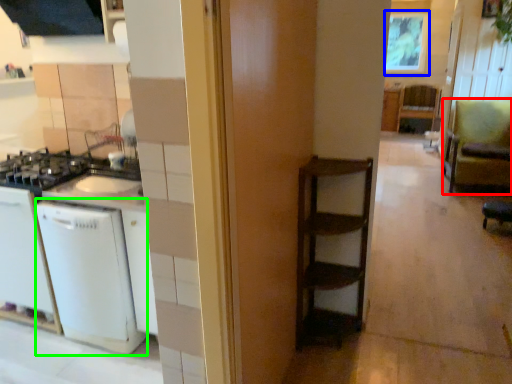
Question: Based on their relative distances, which object is farther from armchair (highlighted by a red box)? Choose from window screen (highlighted by a blue box) and dish washer (highlighted by a green box).

Choices:
 (A) window screen
 (B) dish washer

Answer: (B)